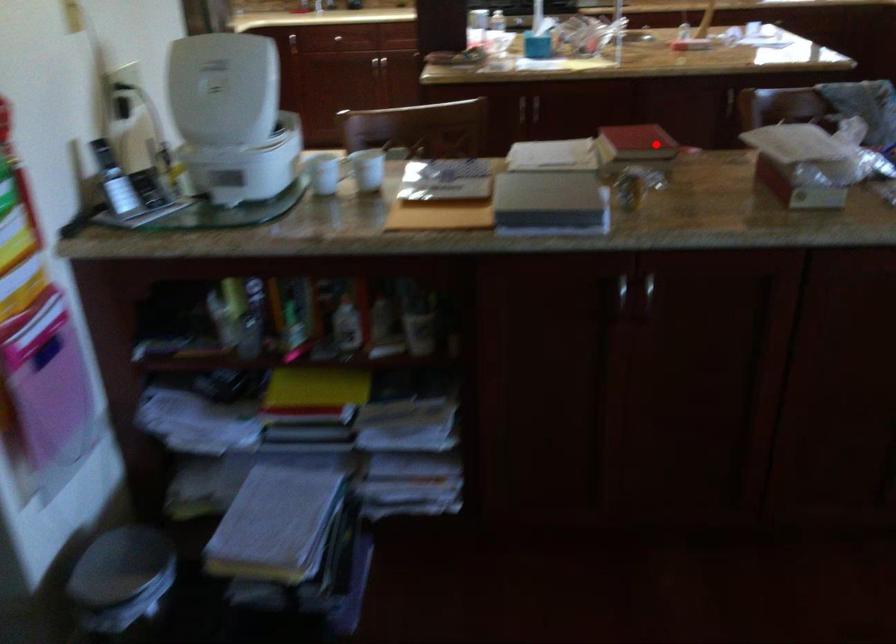
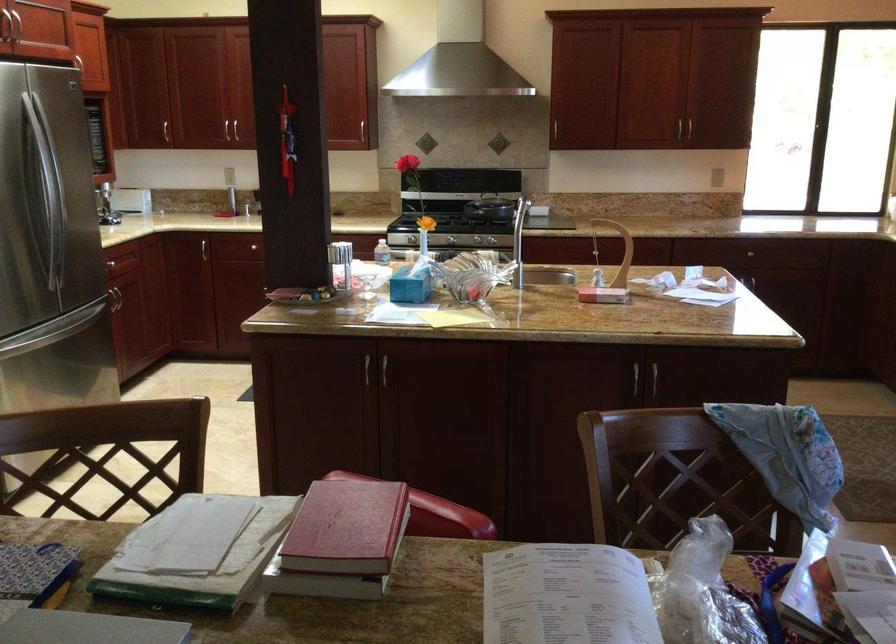
Question: A red point is marked in image1. In image2, is the corresponding 3D point closer to the camera or farther? Reply with the corresponding letter.

Choices:
 (A) The corresponding 3D point is closer.
 (B) The corresponding 3D point is farther.

Answer: (A)